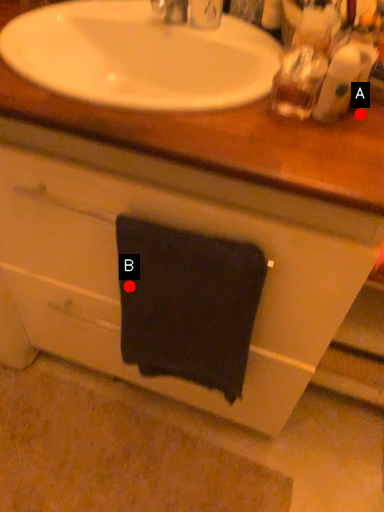
Question: Two points are circled on the image, labeled by A and B beside each circle. Which of the following is the farthest from the observer?

Choices:
 (A) A is further
 (B) B is further

Answer: (B)